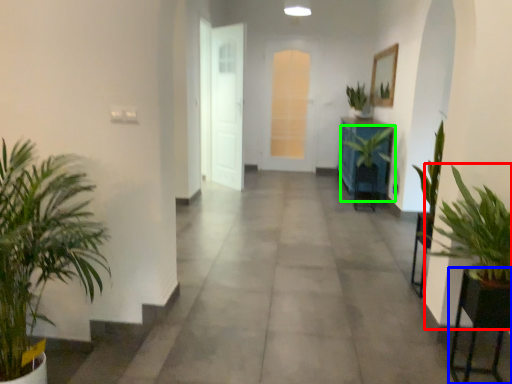
Question: Based on their relative distances, which object is farther from houseplant (highlighted by a red box)? Choose from furniture (highlighted by a blue box) and houseplant (highlighted by a green box).

Choices:
 (A) furniture
 (B) houseplant

Answer: (B)